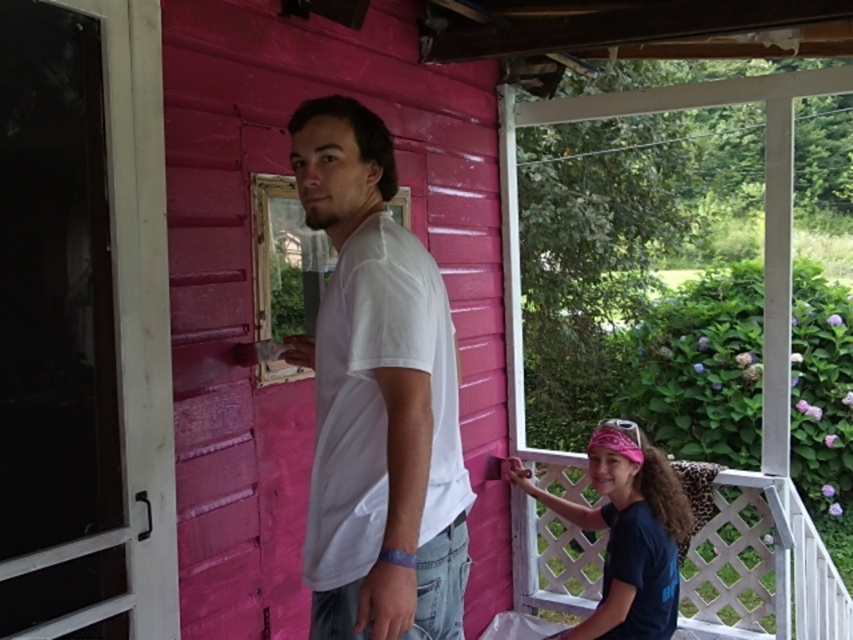
Does white matte t-shirt at center come in front of pink fabric headband at lower right?

Yes, it is.

Does white matte t-shirt at center come behind pink fabric headband at lower right?

That is False.

This screenshot has height=640, width=853. Describe the element at coordinates (376, 397) in the screenshot. I see `white matte t-shirt at center` at that location.

This screenshot has height=640, width=853. I want to click on white matte t-shirt at center, so click(376, 397).